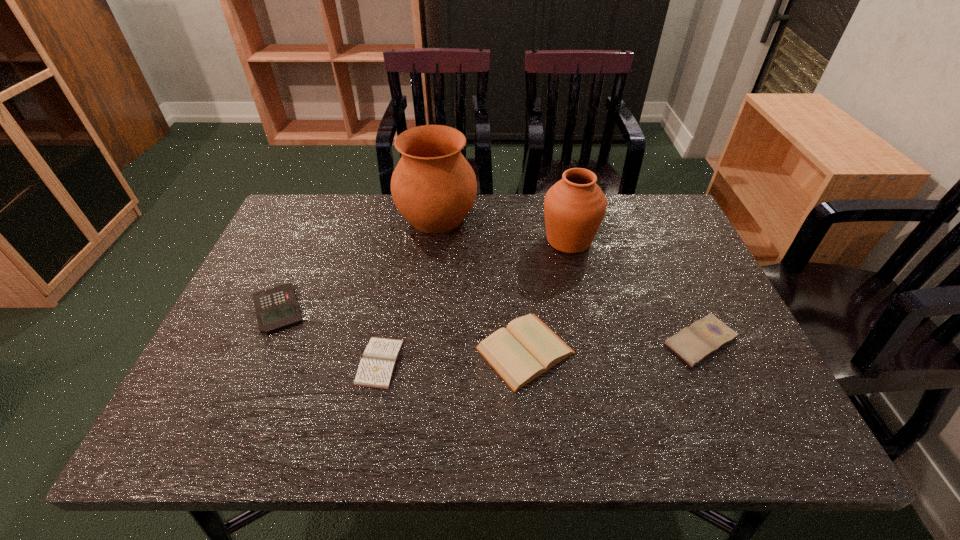
Image resolution: width=960 pixels, height=540 pixels. What are the coordinates of `pottery` in the screenshot? It's located at (433, 186).

You are a GUI agent. You are given a task and a screenshot of the screen. Output one action in this format:
    pyautogui.click(x=<x>, y=<y>)
    Task: Click on the fifth shortest object
    The width and height of the screenshot is (960, 540).
    Given the screenshot: What is the action you would take?
    pyautogui.click(x=574, y=207)

Find the location of a particular element. This screenshot has width=960, height=540. the tallest diary is located at coordinates (526, 348).

Identify the location of the leftmost object. (276, 308).

I want to click on the rightmost object, so click(x=705, y=336).

Locate an element on the screen. The height and width of the screenshot is (540, 960). the second tallest diary is located at coordinates coord(705,336).

I want to click on the shortest object, so click(376, 368).

This screenshot has height=540, width=960. Find the location of `the shortest diary`. the shortest diary is located at coordinates (376, 368).

Find the location of a particular element. The height and width of the screenshot is (540, 960). vacant space located on the left of the pottery is located at coordinates (360, 217).

Where is `vacant region located on the left of the fifth shortest object`? The height and width of the screenshot is (540, 960). vacant region located on the left of the fifth shortest object is located at coordinates (463, 240).